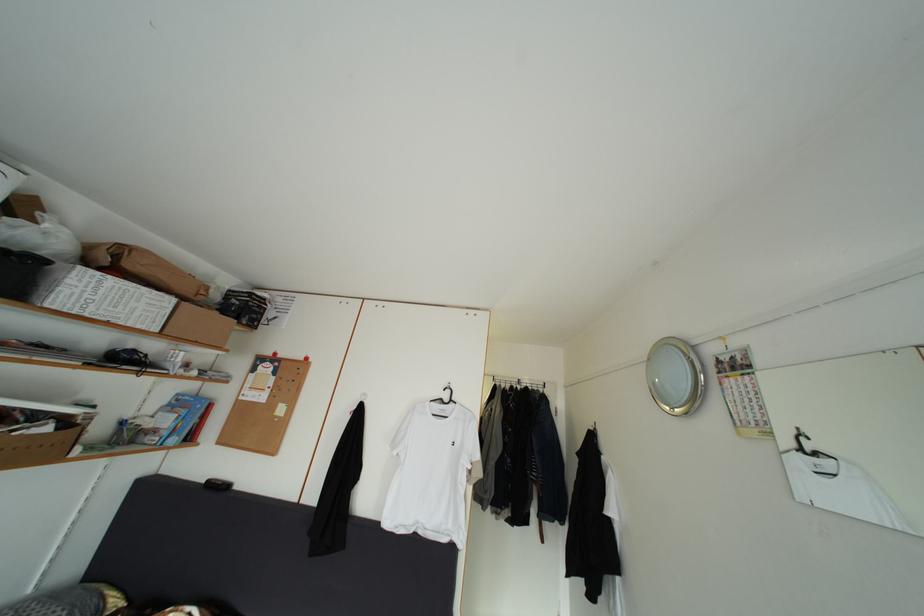
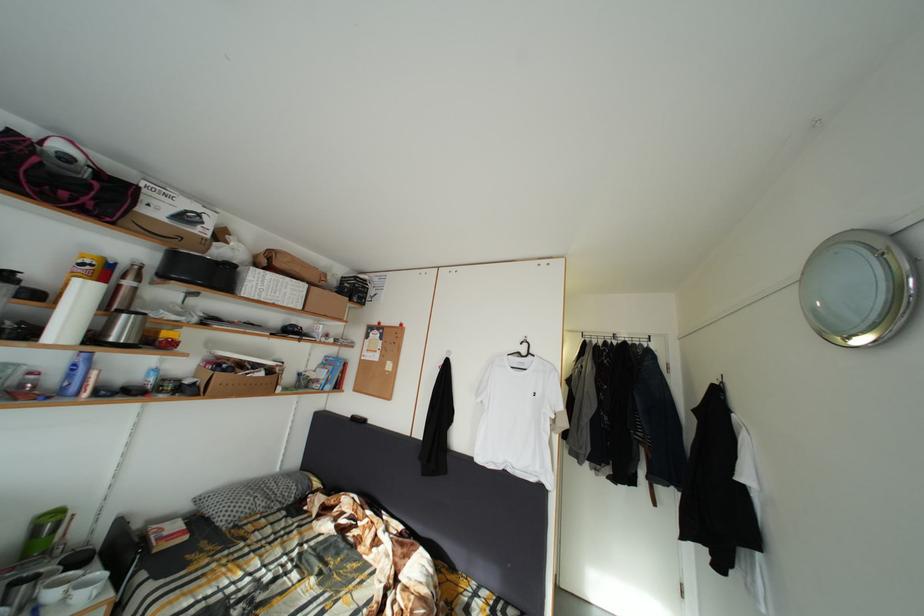
Locate, in the second image, the point that corresponds to point 46,423 in the first image.

(264, 373)